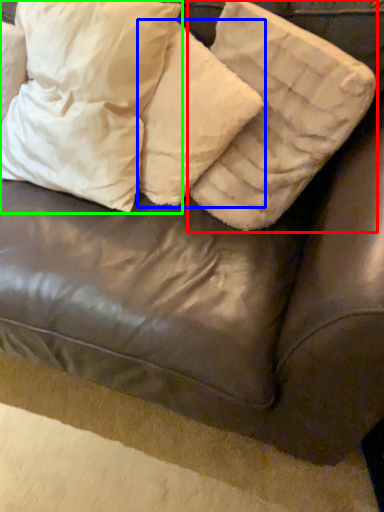
Question: Estimate the real-world distances between objects in this image. Which object is closer to pillow (highlighted by a red box), pillow (highlighted by a blue box) or pillow (highlighted by a green box)?

Choices:
 (A) pillow
 (B) pillow

Answer: (A)